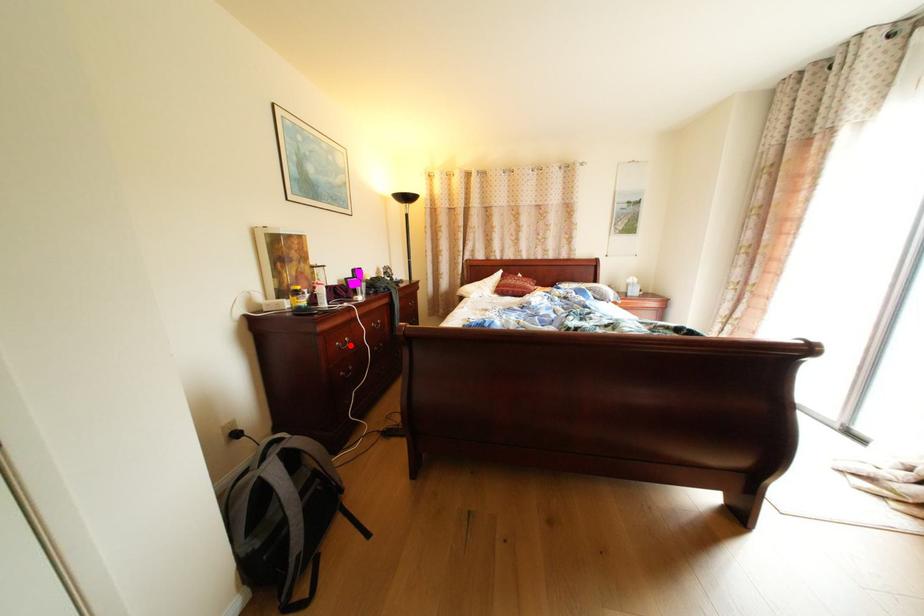
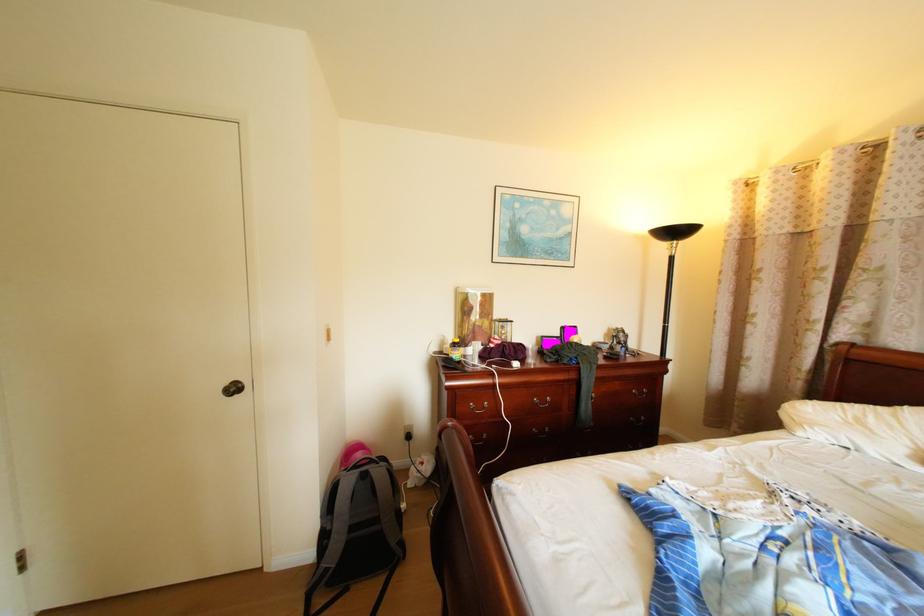
Locate, in the second image, the point that corresponds to the highlighted location in the first image.

(484, 406)